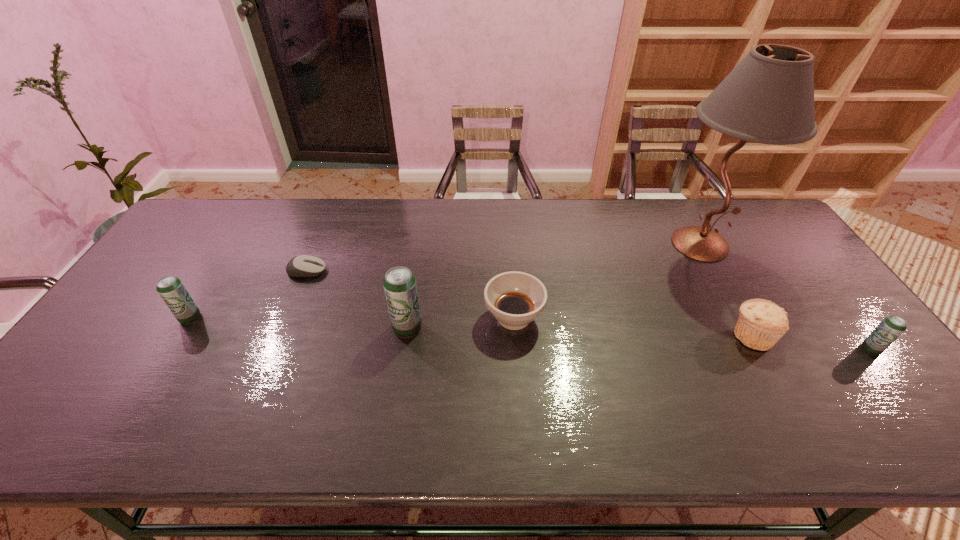
If we want them evenly spaced by inserting an extra beer_can among them, please locate a free spot for this new beer_can. Please provide its 2D coordinates. Your answer should be formatted as a tuple, i.e. [(x, y)], where the tuple contains the x and y coordinates of a point satisfying the conditions above.

[(634, 338)]